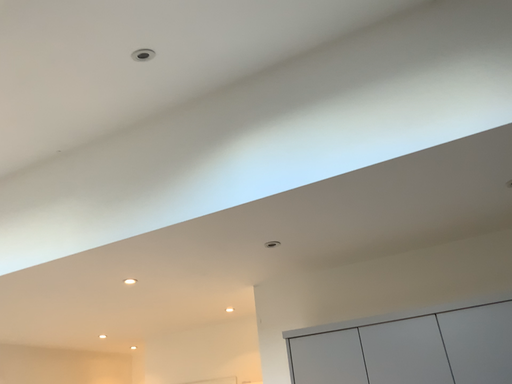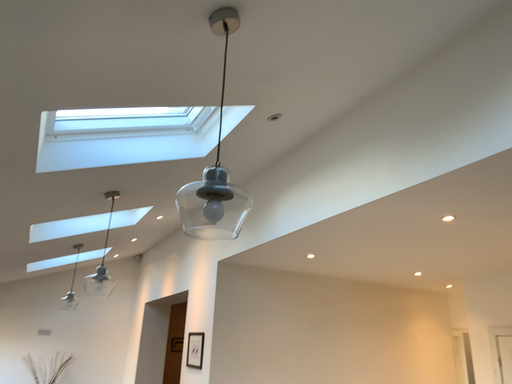
Question: How did the camera likely rotate when shooting the video?

Choices:
 (A) rotated downward
 (B) rotated upward

Answer: (A)